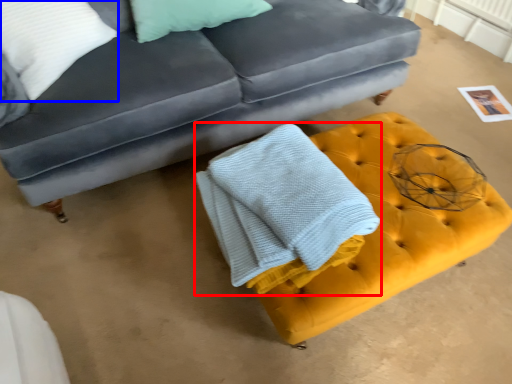
Question: Which object is closer to the camera taking this photo, bath towel (highlighted by a red box) or pillow (highlighted by a blue box)?

Choices:
 (A) bath towel
 (B) pillow

Answer: (A)